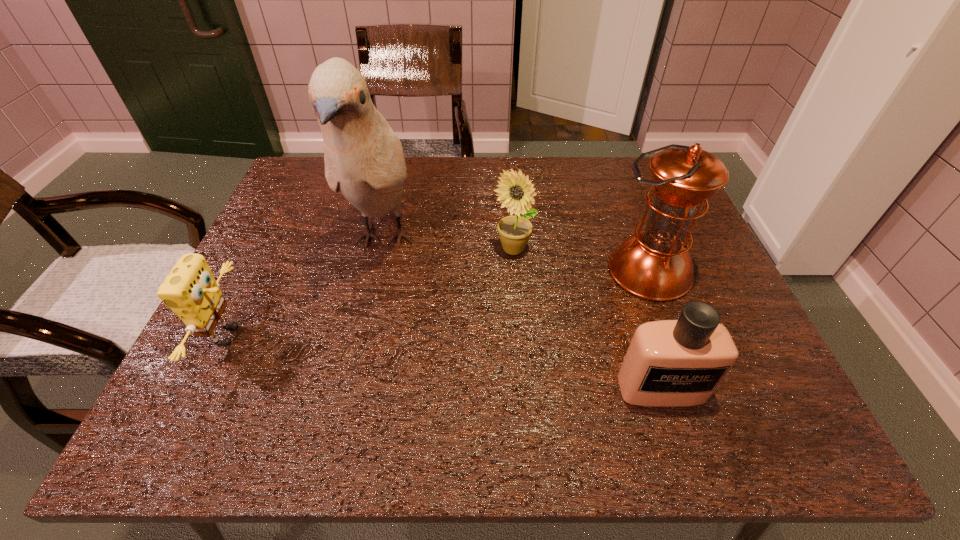
Find the location of a particular element. The width and height of the screenshot is (960, 540). vacant point located on the face of the leftmost object is located at coordinates (280, 335).

Where is `object positioned at the far edge`? Image resolution: width=960 pixels, height=540 pixels. object positioned at the far edge is located at coordinates (364, 159).

Identify the location of object that is at the near edge. (670, 363).

What are the coordinates of `object present at the left edge` in the screenshot? It's located at (190, 290).

Find the location of a particular element. The image size is (960, 540). oil lamp that is positioned at the right edge is located at coordinates (654, 264).

What are the coordinates of `perfume that is at the right edge` in the screenshot? It's located at (670, 363).

This screenshot has height=540, width=960. Identify the location of object that is at the near right corner. (670, 363).

Locate an element on the screen. This screenshot has width=960, height=540. vacant area at the far edge is located at coordinates (595, 165).

Image resolution: width=960 pixels, height=540 pixels. In order to click on free spot at the near edge of the desktop in this screenshot , I will do `click(683, 446)`.

What are the coordinates of `free space at the left edge of the desktop` in the screenshot? It's located at (312, 224).